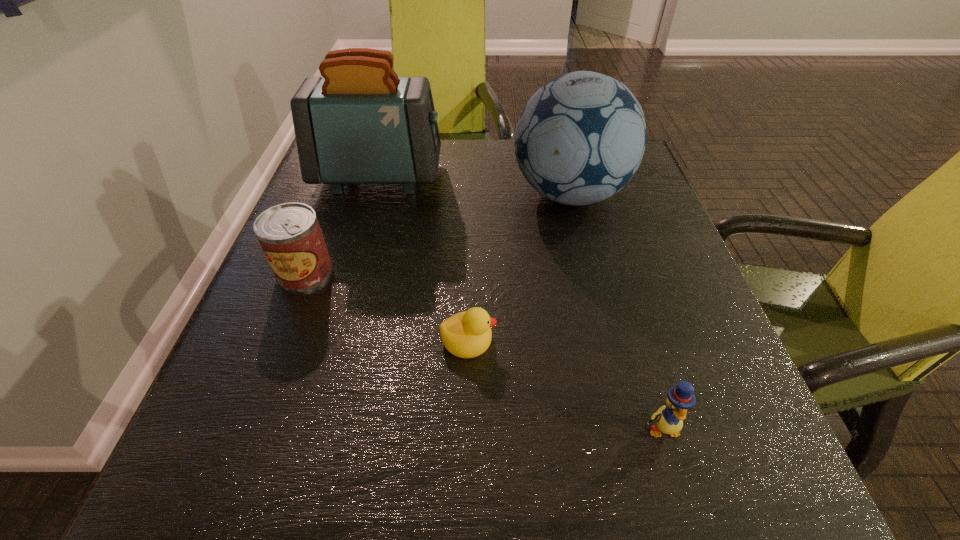
I want to click on object located in the far left corner section of the desktop, so click(359, 123).

Find the location of a particular element. The width and height of the screenshot is (960, 540). object at the far right corner is located at coordinates (581, 137).

Identify the location of vacant space at the far edge of the desktop. (504, 164).

This screenshot has width=960, height=540. In the image, there is a desktop. Find the location of `vacant space at the near edge`. vacant space at the near edge is located at coordinates click(x=312, y=485).

In order to click on free point at the left edge in this screenshot , I will do `click(347, 212)`.

In the image, there is a desktop. In order to click on vacant space at the right edge in this screenshot , I will do `click(672, 245)`.

What are the coordinates of `vacant area at the far right corner` in the screenshot? It's located at (644, 181).

Image resolution: width=960 pixels, height=540 pixels. I want to click on free point between the soccer ball and the third farthest object, so click(x=438, y=233).

Where is `unoccupied area between the second nearest object and the third shortest object`? The width and height of the screenshot is (960, 540). unoccupied area between the second nearest object and the third shortest object is located at coordinates (387, 306).

Identify the location of vacant region between the toaster and the nearest object. Image resolution: width=960 pixels, height=540 pixels. (520, 302).